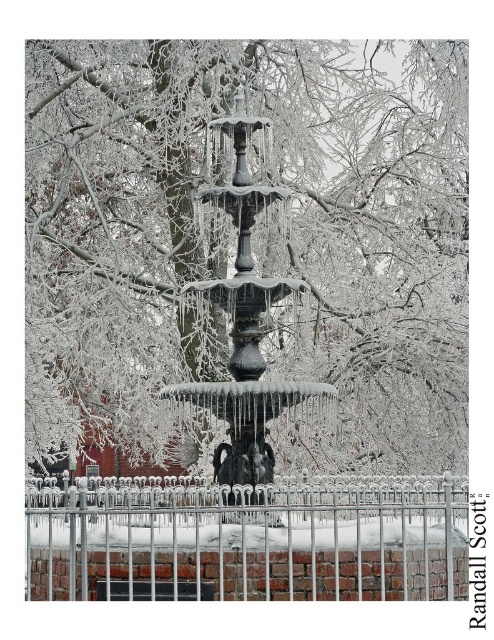
This screenshot has width=494, height=640. I want to click on white frosted branches at center, so click(x=242, y=253).

Who is taller, white frosted branches at center or polished bronze fountain at center?

white frosted branches at center

Where is `white frosted branches at center`? Image resolution: width=494 pixels, height=640 pixels. white frosted branches at center is located at coordinates (242, 253).

Does white metal fence at lower center have a lesser height compared to polished bronze fountain at center?

Indeed, white metal fence at lower center has a lesser height compared to polished bronze fountain at center.

Is white metal fence at lower center thinner than polished bronze fountain at center?

No.

Measure the distance between point (163, 572) and camera.

57.00 feet

The image size is (494, 640). What are the coordinates of `white metal fence at lower center` in the screenshot? It's located at (248, 541).

Is white frosted branches at center bigger than white metal fence at lower center?

Yes.

Where is `white frosted branches at center`? This screenshot has height=640, width=494. white frosted branches at center is located at coordinates (242, 253).